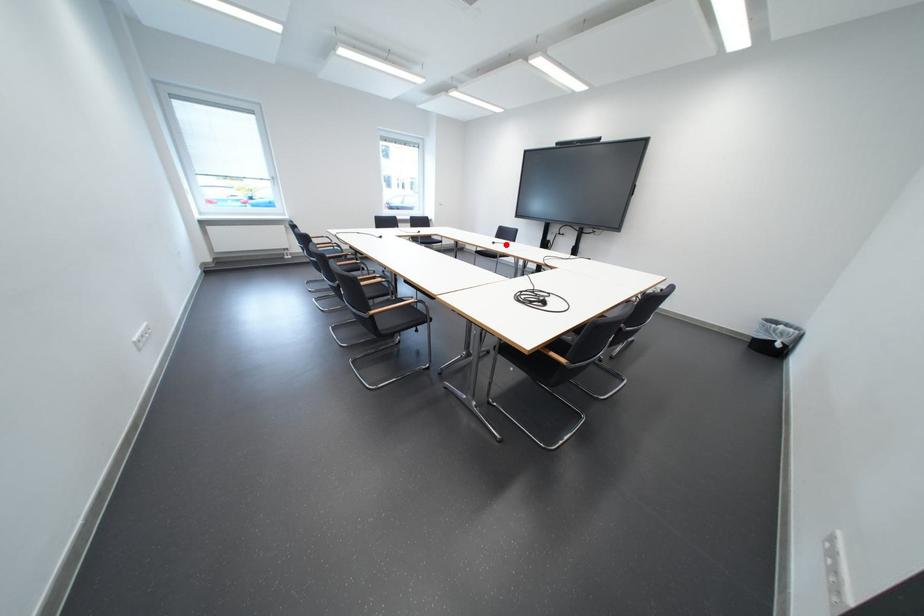
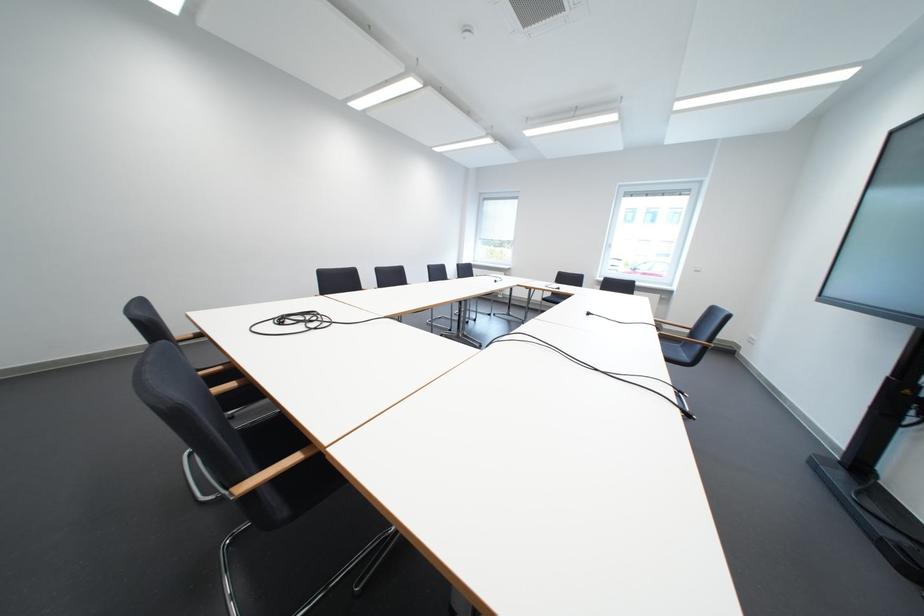
The point at the highlighted location is marked in the first image. Where is the corresponding point in the second image?

(601, 315)